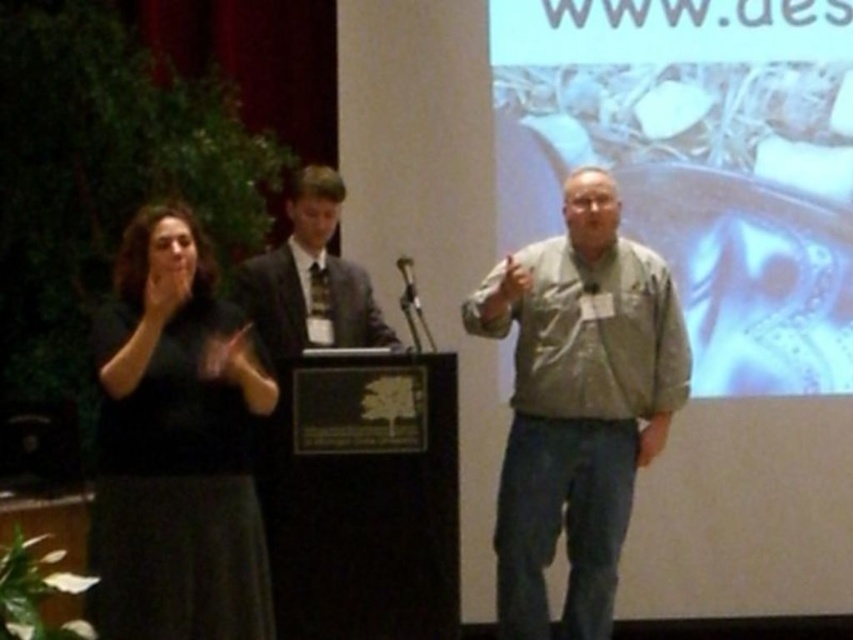
Based on the photo, what object is located at the coordinates point (698, 163)?

The metallic silver gear at upper right is located at point (698, 163).

You are attending a formal event and notice two attendees dressed in formal attire. The black matte dress at left and the dark gray suit at center. Which one is positioned to the left of the other?

The black matte dress at left is positioned to the left of the dark gray suit at center.